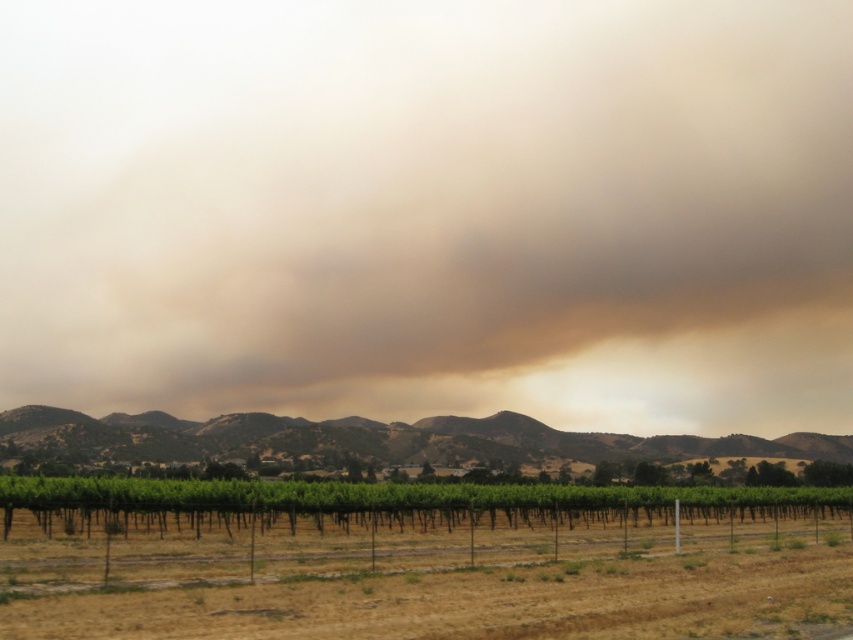
You are a weather observer standing in the vineyard and notice a brown dusty cloud in the sky. Based on its position at point (430, 211), can you determine whether the cloud is closer to the top or bottom of the image?

The brown dusty cloud at upper center is located at point (430, 211). Since the y coordinate is 0.505, which is closer to 1.0 than 0.0, the cloud is closer to the top of the image.

You are standing at the point labeled as point (418, 560) in the image. Based on the scene, what type of terrain are you currently standing on?

The point (418, 560) is on the green leafy vineyard at center, so you are standing on a vineyard terrain.